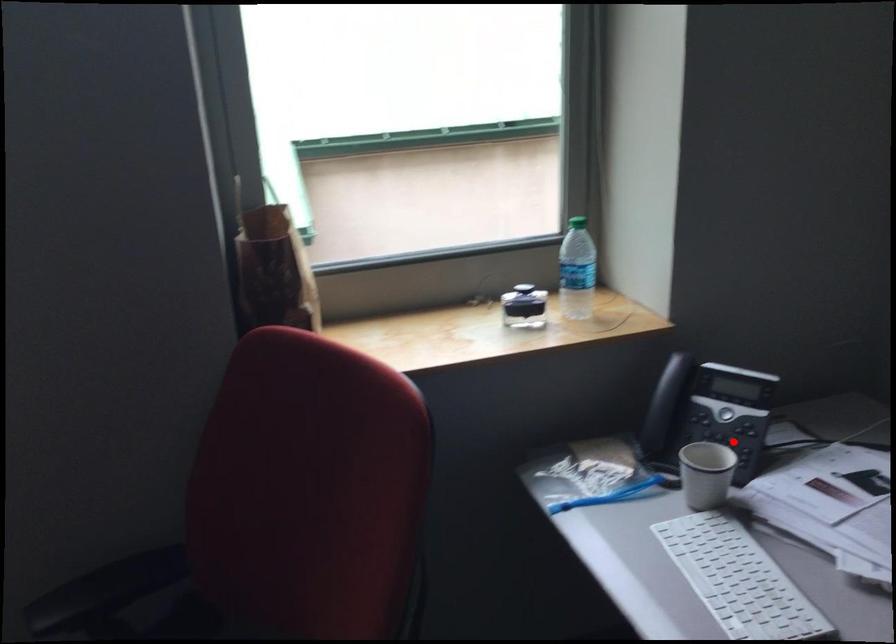
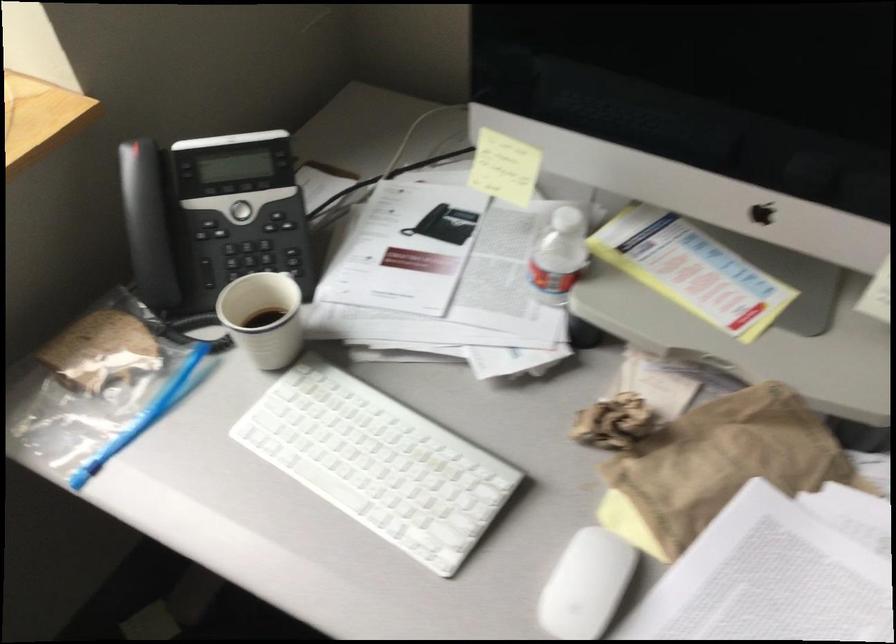
Where in the second image is the point corresponding to the highlighted location from the first image?

(259, 250)